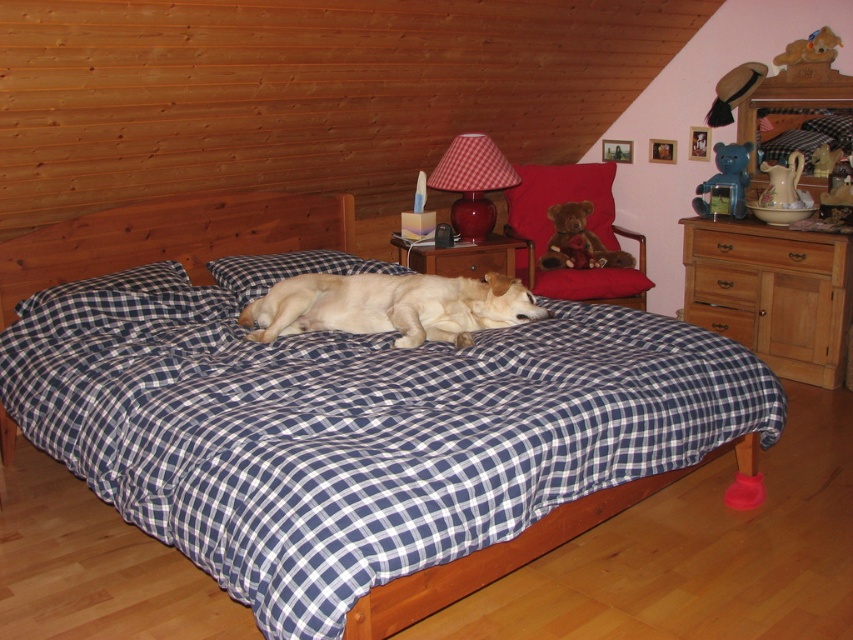
Question: Does wooden dresser at right have a smaller size compared to brown wooden drawer at center?

Choices:
 (A) no
 (B) yes

Answer: (A)

Question: Which object is closer to the camera taking this photo?

Choices:
 (A) blue checkered bed at center
 (B) blue plastic bear at upper right

Answer: (A)

Question: Can you confirm if red plush bear at upper right is positioned to the right of white checkered pillow at center?

Choices:
 (A) yes
 (B) no

Answer: (A)

Question: Which object is closer to the camera taking this photo?

Choices:
 (A) velvet-like beige pillow at upper right
 (B) white checkered pillow at center
 (C) wooden drawer at center right
 (D) wooden drawer at center

Answer: (B)

Question: Is white checkered pillow at center smaller than brown plush bear at upper right?

Choices:
 (A) no
 (B) yes

Answer: (A)

Question: Estimate the real-world distances between objects in this image. Which object is closer to the white plastic candlestick at center?

Choices:
 (A) velvet-like beige pillow at upper right
 (B) brown wooden drawer at center

Answer: (B)